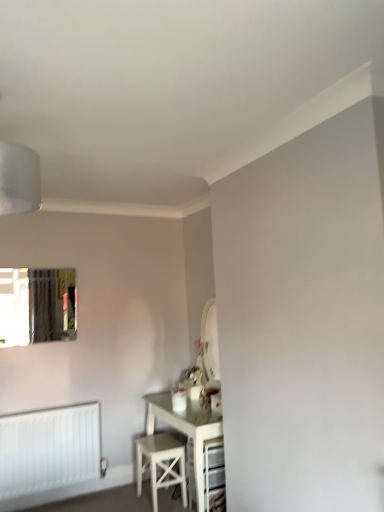
Question: Is clear glass mirror at upper left located outside white matte radiator at lower left?

Choices:
 (A) no
 (B) yes

Answer: (B)

Question: Is clear glass mirror at upper left to the left of white matte radiator at lower left from the viewer's perspective?

Choices:
 (A) no
 (B) yes

Answer: (B)

Question: From the image's perspective, is clear glass mirror at upper left on white matte radiator at lower left?

Choices:
 (A) no
 (B) yes

Answer: (B)

Question: Can you confirm if clear glass mirror at upper left is positioned to the right of white matte radiator at lower left?

Choices:
 (A) yes
 (B) no

Answer: (B)

Question: Does clear glass mirror at upper left have a larger size compared to white matte radiator at lower left?

Choices:
 (A) no
 (B) yes

Answer: (A)

Question: Is white matte radiator at lower left a part of clear glass mirror at upper left?

Choices:
 (A) no
 (B) yes

Answer: (A)

Question: Is white matte radiator at lower left oriented towards clear glass mirror at upper left?

Choices:
 (A) no
 (B) yes

Answer: (A)

Question: Can you confirm if white matte radiator at lower left is bigger than clear glass mirror at upper left?

Choices:
 (A) no
 (B) yes

Answer: (B)

Question: Is white matte radiator at lower left positioned in front of clear glass mirror at upper left?

Choices:
 (A) yes
 (B) no

Answer: (A)

Question: Considering the relative sizes of white matte radiator at lower left and clear glass mirror at upper left in the image provided, is white matte radiator at lower left smaller than clear glass mirror at upper left?

Choices:
 (A) no
 (B) yes

Answer: (A)

Question: From a real-world perspective, does white matte radiator at lower left stand above clear glass mirror at upper left?

Choices:
 (A) yes
 (B) no

Answer: (B)

Question: From a real-world perspective, is white matte radiator at lower left positioned under clear glass mirror at upper left based on gravity?

Choices:
 (A) no
 (B) yes

Answer: (B)

Question: Does clear glass mirror at upper left have a greater width compared to white wood stool at lower center?

Choices:
 (A) yes
 (B) no

Answer: (B)